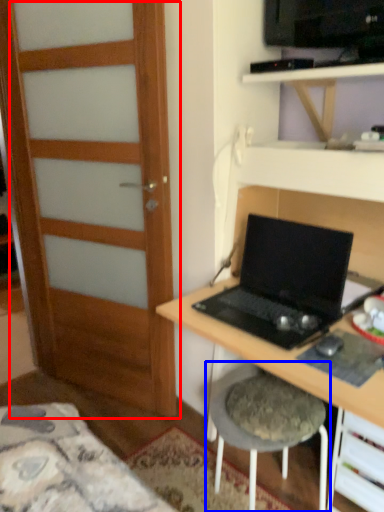
Question: Which object is closer to the camera taking this photo, door (highlighted by a red box) or stool (highlighted by a blue box)?

Choices:
 (A) door
 (B) stool

Answer: (B)